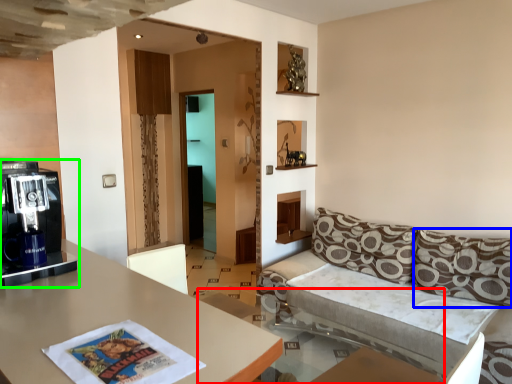
Question: Considering the real-world distances, which object is farthest from glass table (highlighted by a red box)? pillow (highlighted by a blue box) or coffee machine (highlighted by a green box)?

Choices:
 (A) pillow
 (B) coffee machine

Answer: (B)